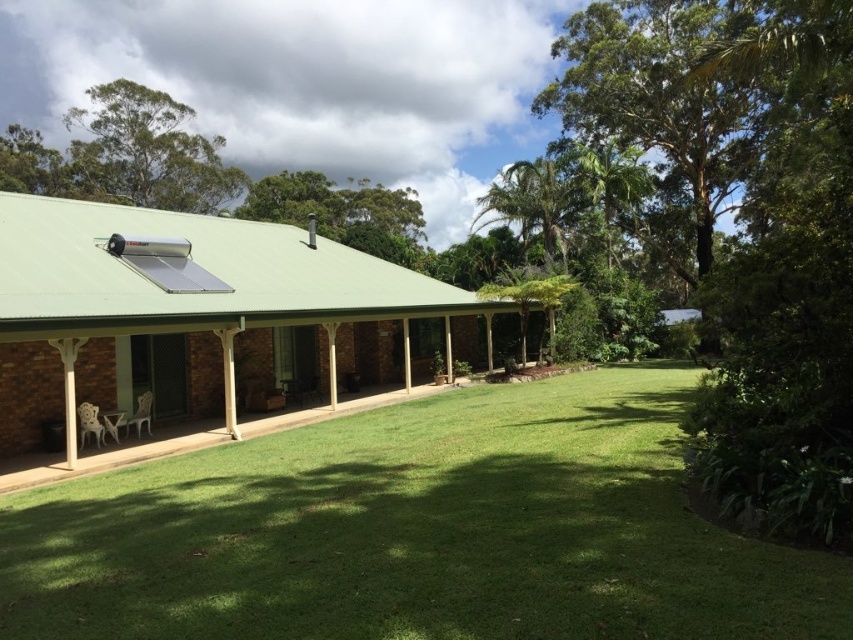
Consider the image. Is green grass at center wider than white plastic chairs at lower left?

No.

Does green grass at center have a lesser width compared to white plastic chairs at lower left?

Yes.

Describe the element at coordinates (416, 531) in the screenshot. I see `green grass at center` at that location.

Identify the location of green grass at center. The width and height of the screenshot is (853, 640). (416, 531).